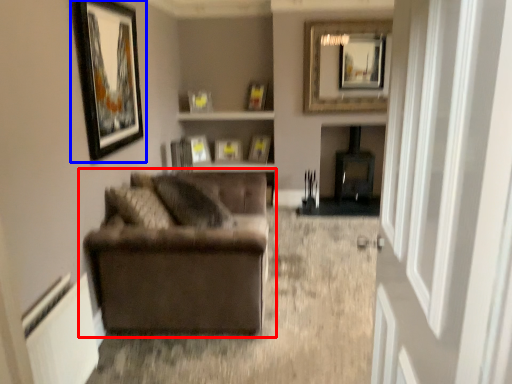
Question: Which point is further to the camera, studio couch (highlighted by a red box) or picture frame (highlighted by a blue box)?

Choices:
 (A) studio couch
 (B) picture frame

Answer: (A)